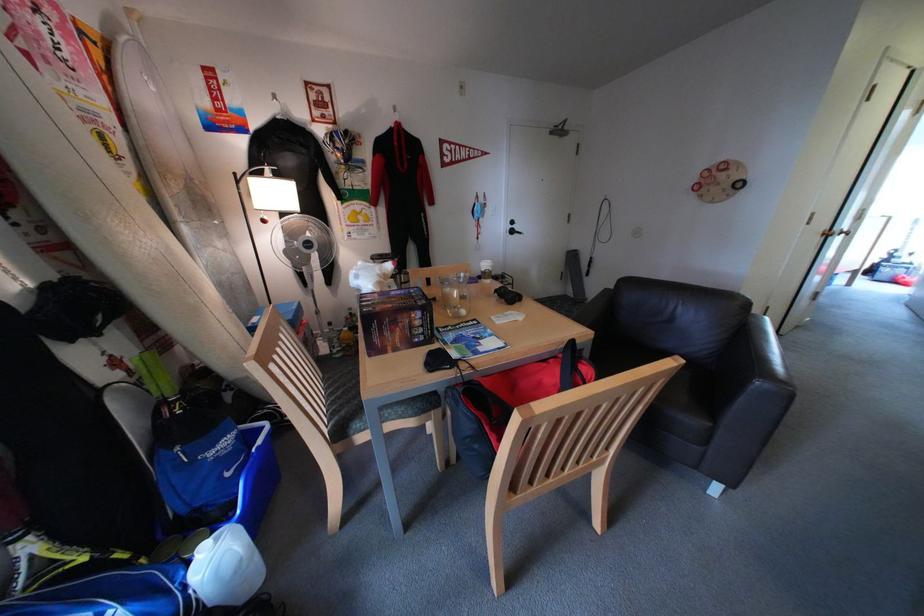
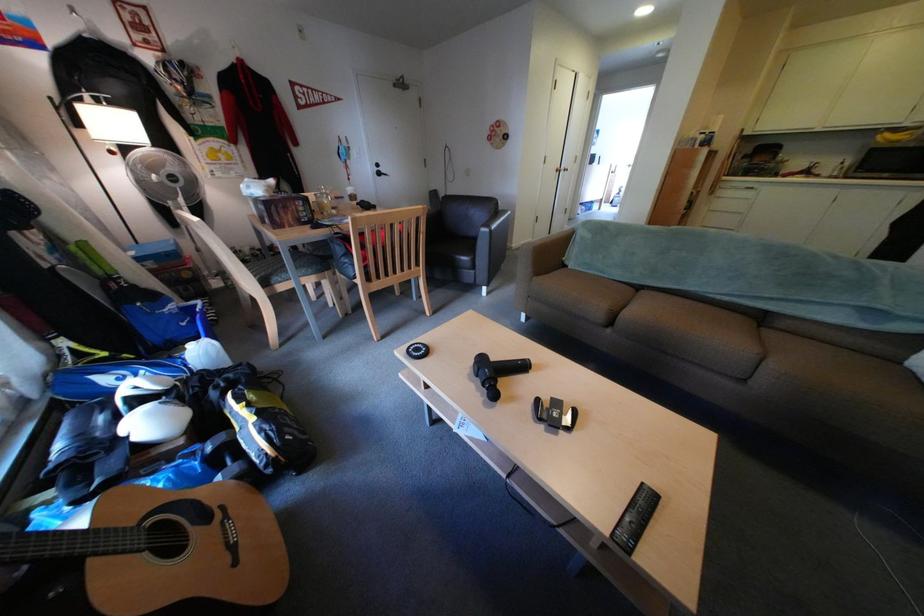
Locate, in the second image, the point that corresponds to point (424, 414) in the first image.

(324, 272)